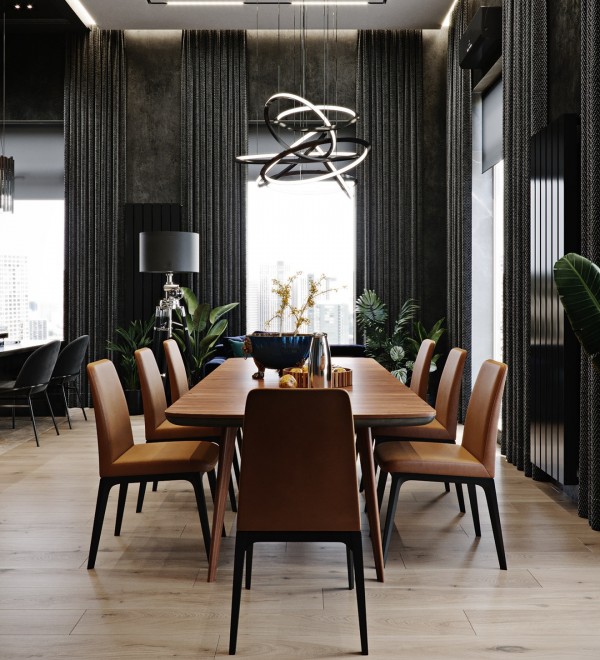
Locate an element on the screen. This screenshot has width=600, height=660. floor is located at coordinates (423, 649).